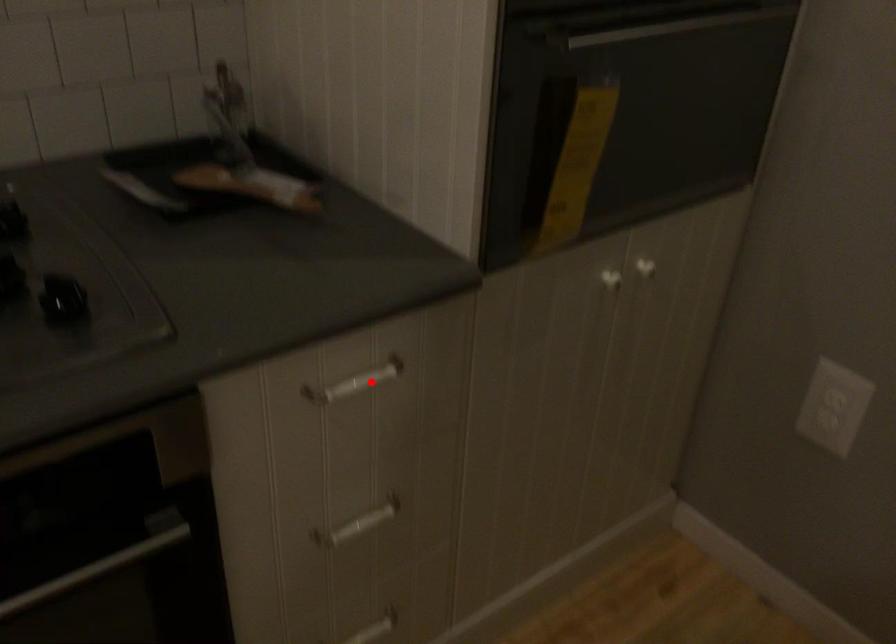
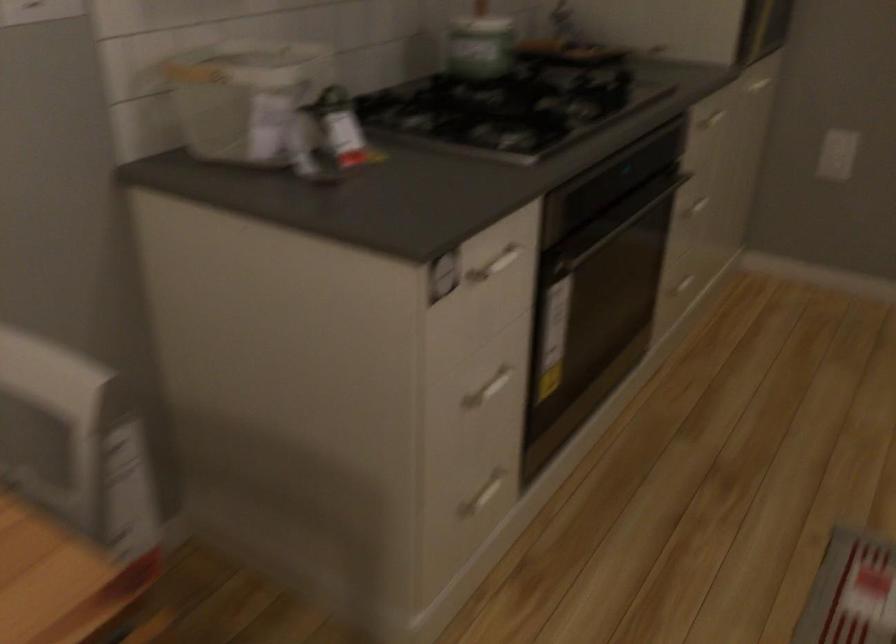
In the second image, find the point that corresponds to the highlighted location in the first image.

(713, 118)